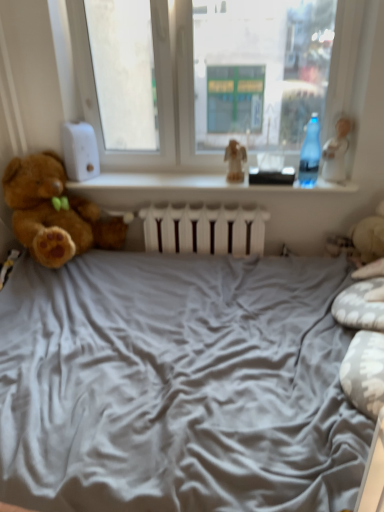
Locate an element on the screen. free point below transparent glass window at center (from a real-world perspective) is located at coordinates (205, 170).